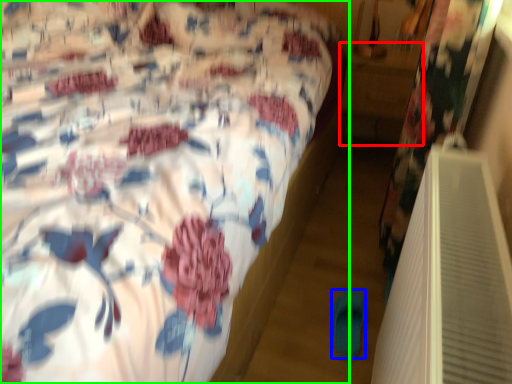
Question: Which object is the farthest from table (highlighted by a red box)? Choose among these: slipper (highlighted by a blue box) or bed (highlighted by a green box).

Choices:
 (A) slipper
 (B) bed

Answer: (A)